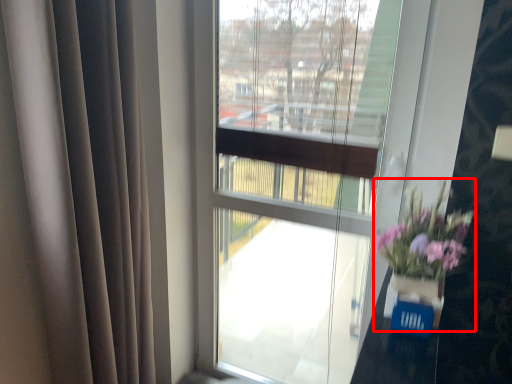
Question: From the image's perspective, where is floral arrangement (annotated by the red box) located in relation to glass vase in the image?

Choices:
 (A) above
 (B) below

Answer: (A)